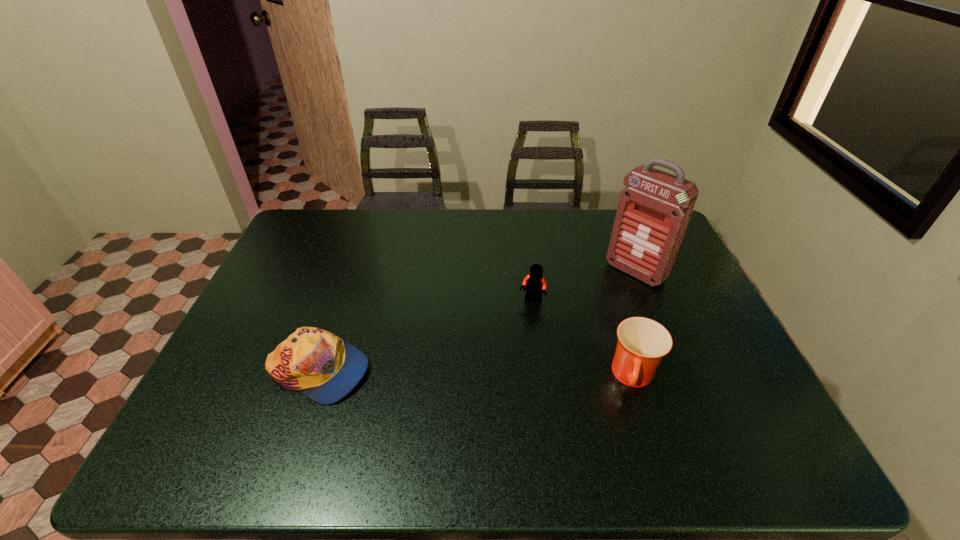
Identify the location of vacant space on the desktop that is between the cap and the cup and is positioned on the front-facing side of the second object from left to right. The width and height of the screenshot is (960, 540). (494, 375).

Where is `free space on the desktop that is between the shortest object and the cup and is positioned on the front-facing side of the farthest object`? free space on the desktop that is between the shortest object and the cup and is positioned on the front-facing side of the farthest object is located at coordinates (518, 375).